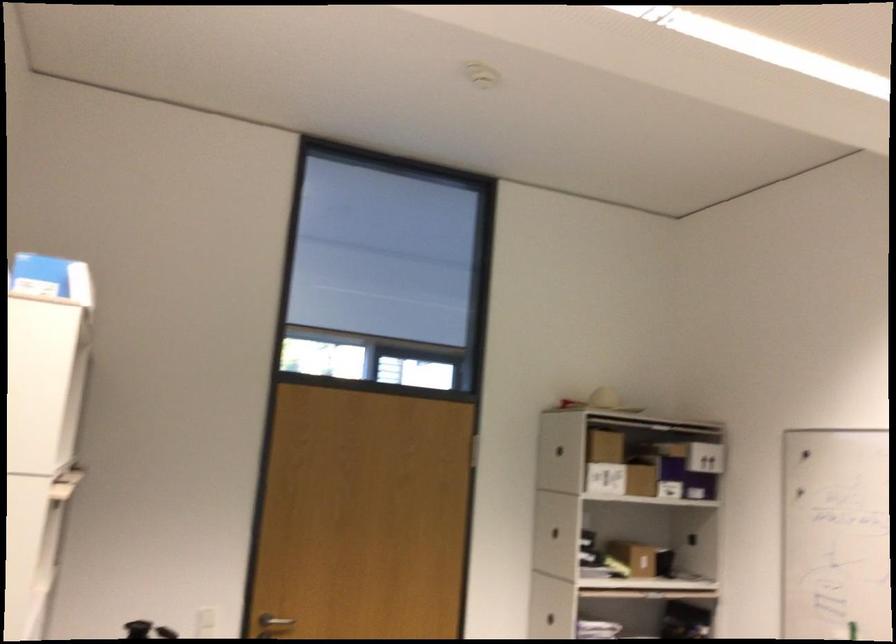
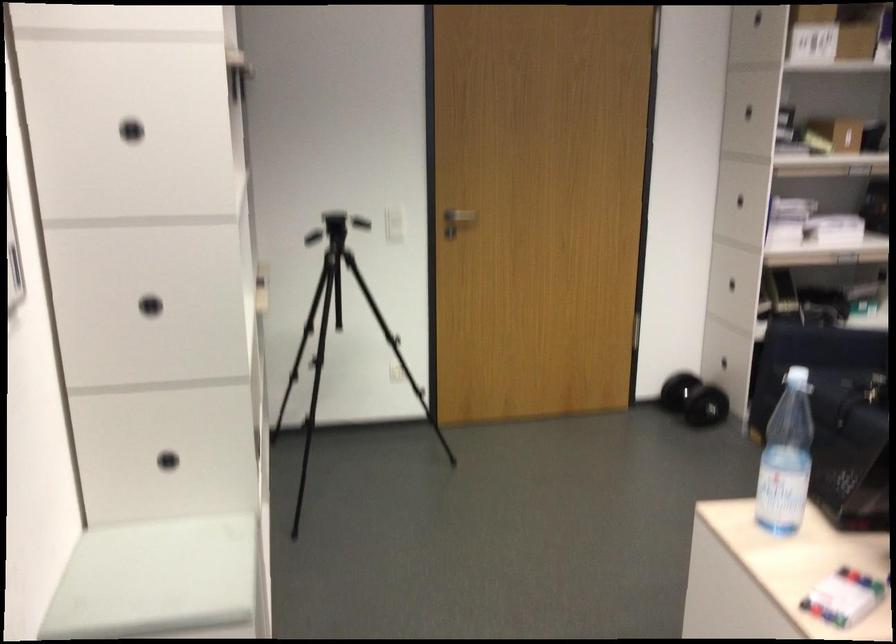
Question: The images are taken continuously from a first-person perspective. In which direction are you moving?

Choices:
 (A) Left
 (B) Right
 (C) Forward
 (D) Backward

Answer: (A)